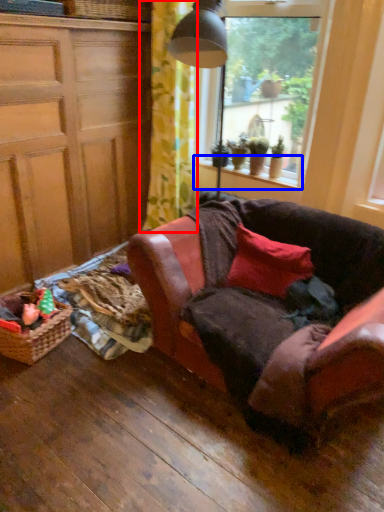
Question: Which object is further to the camera taking this photo, curtain (highlighted by a red box) or window sill (highlighted by a blue box)?

Choices:
 (A) curtain
 (B) window sill

Answer: (B)